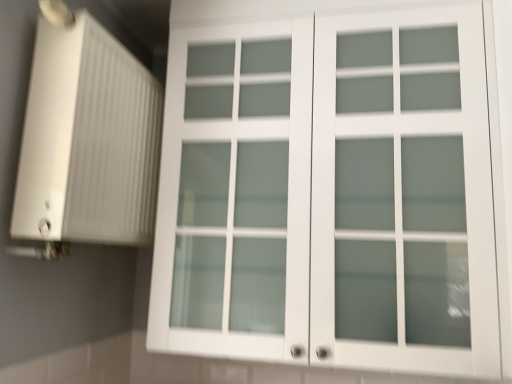
Question: Is point (366, 152) positioned closer to the camera than point (136, 155)?

Choices:
 (A) farther
 (B) closer

Answer: (B)

Question: From their relative heights in the image, would you say white matte cabinet at upper center is taller or shorter than white ribbed plastic at left?

Choices:
 (A) tall
 (B) short

Answer: (A)

Question: Would you say white matte cabinet at upper center is to the left or to the right of white ribbed plastic at left in the picture?

Choices:
 (A) left
 (B) right

Answer: (B)

Question: From the image's perspective, is white ribbed plastic at left located above or below white matte cabinet at upper center?

Choices:
 (A) above
 (B) below

Answer: (A)

Question: In terms of width, does white ribbed plastic at left look wider or thinner when compared to white matte cabinet at upper center?

Choices:
 (A) thin
 (B) wide

Answer: (A)

Question: From a real-world perspective, relative to white matte cabinet at upper center, is white ribbed plastic at left vertically above or below?

Choices:
 (A) below
 (B) above

Answer: (B)

Question: Based on their sizes in the image, would you say white ribbed plastic at left is bigger or smaller than white matte cabinet at upper center?

Choices:
 (A) small
 (B) big

Answer: (A)